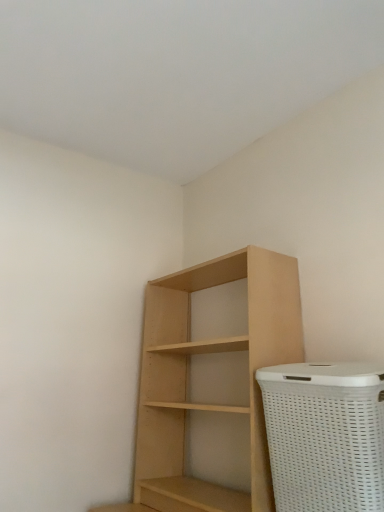
Question: Is natural wood shelf at center further to the viewer compared to white woven basket at lower right?

Choices:
 (A) no
 (B) yes

Answer: (B)

Question: From a real-world perspective, does natural wood shelf at center stand above white woven basket at lower right?

Choices:
 (A) yes
 (B) no

Answer: (A)

Question: Is natural wood shelf at center turned away from white woven basket at lower right?

Choices:
 (A) yes
 (B) no

Answer: (B)

Question: Can you confirm if natural wood shelf at center is positioned to the right of white woven basket at lower right?

Choices:
 (A) yes
 (B) no

Answer: (B)

Question: Does natural wood shelf at center have a lesser width compared to white woven basket at lower right?

Choices:
 (A) no
 (B) yes

Answer: (A)

Question: From the image's perspective, is natural wood shelf at center above white woven basket at lower right?

Choices:
 (A) no
 (B) yes

Answer: (B)

Question: Does white woven basket at lower right contain natural wood shelf at center?

Choices:
 (A) no
 (B) yes

Answer: (A)

Question: Are white woven basket at lower right and natural wood shelf at center located far from each other?

Choices:
 (A) yes
 (B) no

Answer: (B)

Question: From a real-world perspective, is white woven basket at lower right located beneath natural wood shelf at center?

Choices:
 (A) yes
 (B) no

Answer: (A)

Question: Does white woven basket at lower right turn towards natural wood shelf at center?

Choices:
 (A) yes
 (B) no

Answer: (B)

Question: Is white woven basket at lower right thinner than natural wood shelf at center?

Choices:
 (A) no
 (B) yes

Answer: (B)

Question: Is white woven basket at lower right positioned before natural wood shelf at center?

Choices:
 (A) no
 (B) yes

Answer: (B)

Question: Considering the positions of natural wood shelf at center and white woven basket at lower right in the image, is natural wood shelf at center bigger or smaller than white woven basket at lower right?

Choices:
 (A) small
 (B) big

Answer: (B)